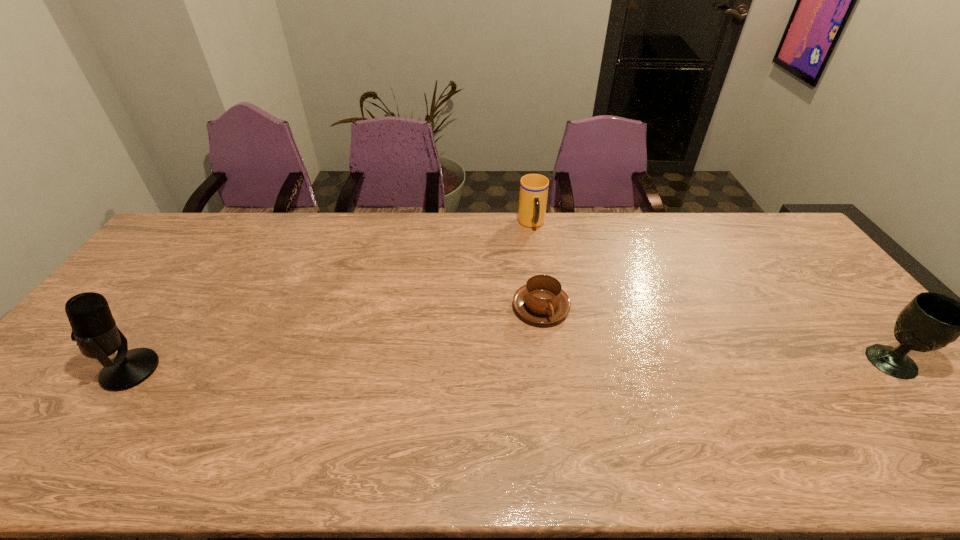
You are a GUI agent. You are given a task and a screenshot of the screen. Output one action in this format:
    pyautogui.click(x=<x>, y=<y>)
    Task: Click on the vacant space located 0.350m on the side of the farthest object with the handle
    The image size is (960, 540).
    Given the screenshot: What is the action you would take?
    pyautogui.click(x=556, y=306)

Where is `free space located 0.220m on the side of the farthest object with the handle`? The height and width of the screenshot is (540, 960). free space located 0.220m on the side of the farthest object with the handle is located at coordinates (547, 277).

I want to click on free spot located 0.390m on the side of the farthest object with the handle, so click(559, 316).

This screenshot has width=960, height=540. In order to click on free space located on the side of the shortest object with the handle in this screenshot , I will do `click(600, 364)`.

The image size is (960, 540). Identify the location of vacant space located 0.190m on the side of the shortest object with the handle. (609, 373).

I want to click on vacant space located on the side of the shortest object with the handle, so click(x=624, y=387).

At what (x,y) coordinates should I click in order to perform the action: click on object that is positioned at the far edge. Please return your answer as a coordinate pair (x, y). This screenshot has height=540, width=960. Looking at the image, I should click on (533, 195).

This screenshot has width=960, height=540. I want to click on object that is at the left edge, so click(94, 329).

Find the location of a particular element. Image resolution: width=960 pixels, height=540 pixels. object at the right edge is located at coordinates (931, 321).

What are the coordinates of `vacant position at the far edge of the desktop` in the screenshot? It's located at (552, 237).